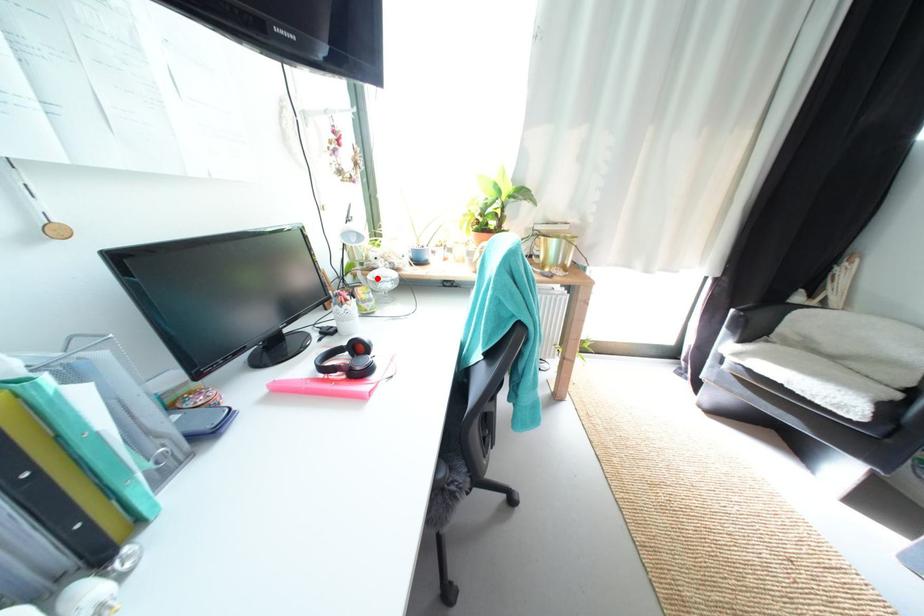
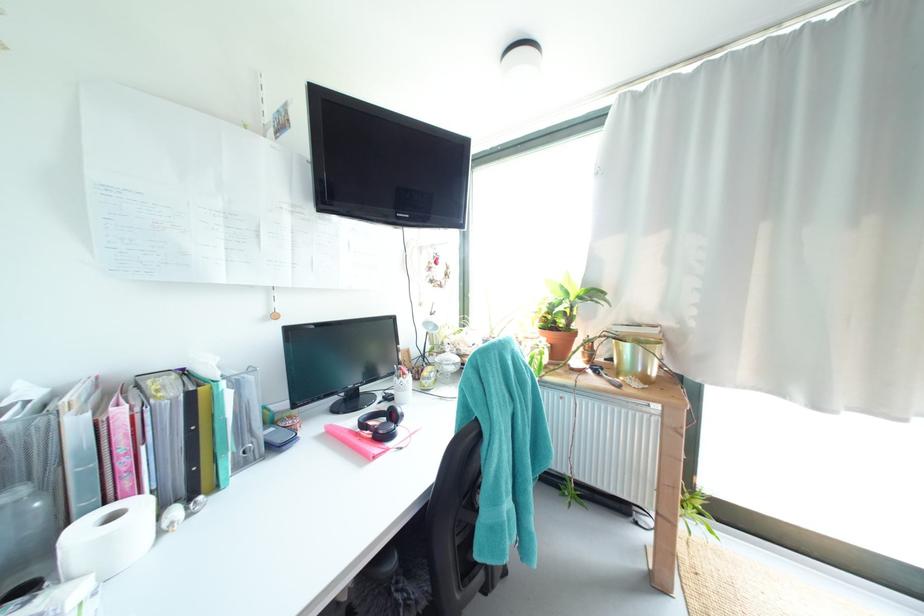
Question: I am providing you with two images of the same scene from different viewpoints. In image1, a red point is highlighted. Considering the same 3D point in image2, which of the following is correct?

Choices:
 (A) It is closer
 (B) It is farther

Answer: (B)